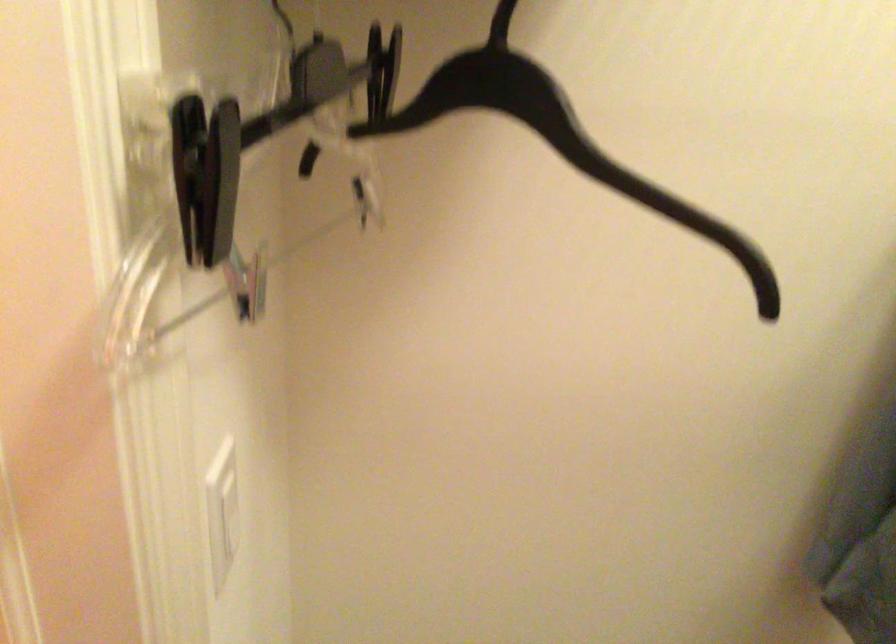
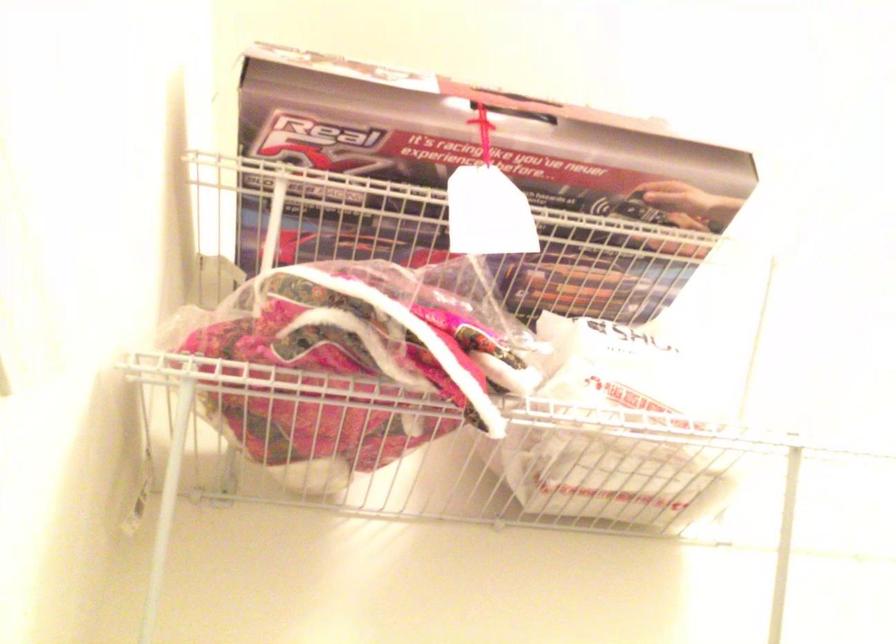
First-person continuous shooting, in which direction is the camera rotating?

The camera rotated toward right-up.